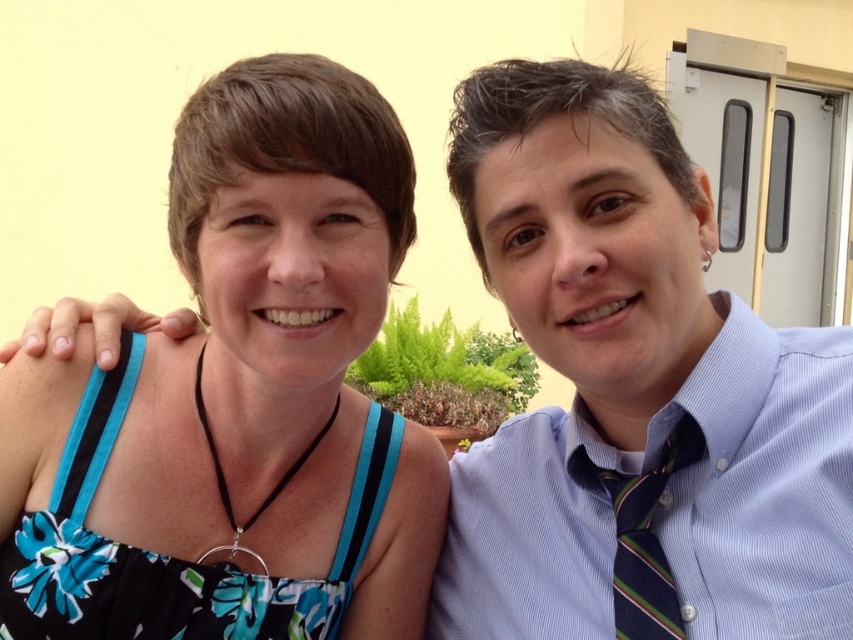
Does point (161, 406) come farther from viewer compared to point (634, 532)?

Yes, point (161, 406) is behind point (634, 532).

Describe the element at coordinates (236, 400) in the screenshot. I see `blue floral dress at left` at that location.

At what (x,y) coordinates should I click in order to perform the action: click on blue floral dress at left. Please return your answer as a coordinate pair (x, y). Looking at the image, I should click on (236, 400).

From the picture: Does blue floral dress at left appear on the right side of black floral fabric dress at left?

Indeed, blue floral dress at left is positioned on the right side of black floral fabric dress at left.

Does blue floral dress at left have a lesser width compared to black floral fabric dress at left?

No, blue floral dress at left is not thinner than black floral fabric dress at left.

Is point (200, 470) behind point (357, 531)?

No, it is in front of (357, 531).

At what (x,y) coordinates should I click in order to perform the action: click on blue floral dress at left. Please return your answer as a coordinate pair (x, y). Looking at the image, I should click on (236, 400).

Is blue floral dress at left wider than light blue striped shirt at right?

Indeed, blue floral dress at left has a greater width compared to light blue striped shirt at right.

Looking at this image, who is higher up, blue floral dress at left or light blue striped shirt at right?

blue floral dress at left is above.

Does point (129, 600) come in front of point (822, 586)?

No, (129, 600) is further to viewer.

Identify the location of blue floral dress at left. (236, 400).